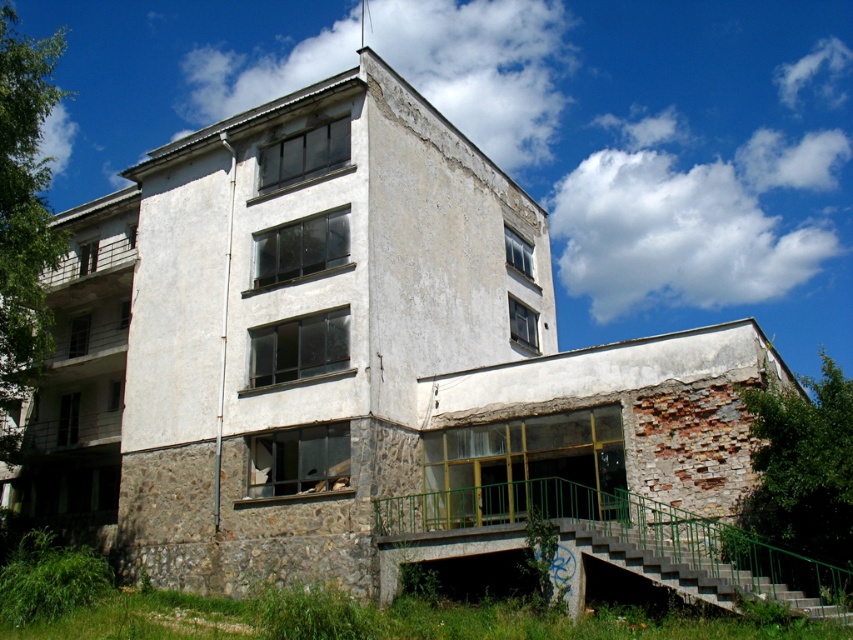
Question: Can you confirm if green metal railing at lower center is positioned above concrete stairs at lower right?

Choices:
 (A) no
 (B) yes

Answer: (A)

Question: Does green metal railing at lower center have a lesser width compared to concrete stairs at lower right?

Choices:
 (A) yes
 (B) no

Answer: (B)

Question: Which object appears farthest from the camera in this image?

Choices:
 (A) green metal railing at lower center
 (B) concrete stairs at lower right

Answer: (A)

Question: Is the position of green metal railing at lower center more distant than that of concrete stairs at lower right?

Choices:
 (A) yes
 (B) no

Answer: (A)

Question: Which point is closer to the camera taking this photo?

Choices:
 (A) (642, 529)
 (B) (706, 588)

Answer: (B)